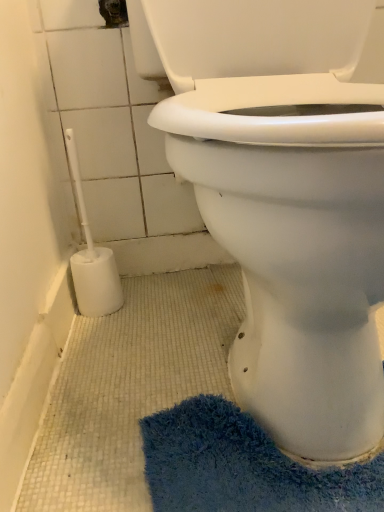
Question: From a real-world perspective, is blue shaggy bath mat at lower right physically below white plastic toilet brush at lower left?

Choices:
 (A) no
 (B) yes

Answer: (B)

Question: Considering the relative sizes of blue shaggy bath mat at lower right and white plastic toilet brush at lower left in the image provided, is blue shaggy bath mat at lower right thinner than white plastic toilet brush at lower left?

Choices:
 (A) yes
 (B) no

Answer: (B)

Question: Can you confirm if blue shaggy bath mat at lower right is positioned to the left of white plastic toilet brush at lower left?

Choices:
 (A) no
 (B) yes

Answer: (A)

Question: Does blue shaggy bath mat at lower right turn towards white plastic toilet brush at lower left?

Choices:
 (A) yes
 (B) no

Answer: (B)

Question: From the image's perspective, is blue shaggy bath mat at lower right above white plastic toilet brush at lower left?

Choices:
 (A) no
 (B) yes

Answer: (A)

Question: Is blue shaggy bath mat at lower right positioned far away from white plastic toilet brush at lower left?

Choices:
 (A) yes
 (B) no

Answer: (B)

Question: Is white plastic toilet brush at lower left closer to the viewer compared to white plastic toilet brush at left?

Choices:
 (A) no
 (B) yes

Answer: (A)

Question: Is white plastic toilet brush at lower left looking in the opposite direction of white plastic toilet brush at left?

Choices:
 (A) yes
 (B) no

Answer: (B)

Question: Considering the relative sizes of white plastic toilet brush at lower left and white plastic toilet brush at left in the image provided, is white plastic toilet brush at lower left bigger than white plastic toilet brush at left?

Choices:
 (A) no
 (B) yes

Answer: (A)

Question: Is white plastic toilet brush at lower left not inside white plastic toilet brush at left?

Choices:
 (A) yes
 (B) no

Answer: (A)

Question: Is white plastic toilet brush at lower left at the left side of white plastic toilet brush at left?

Choices:
 (A) no
 (B) yes

Answer: (B)

Question: Are white plastic toilet brush at lower left and white plastic toilet brush at left making contact?

Choices:
 (A) no
 (B) yes

Answer: (A)

Question: Is the depth of white plastic toilet brush at lower left less than that of blue shaggy bath mat at lower right?

Choices:
 (A) yes
 (B) no

Answer: (B)